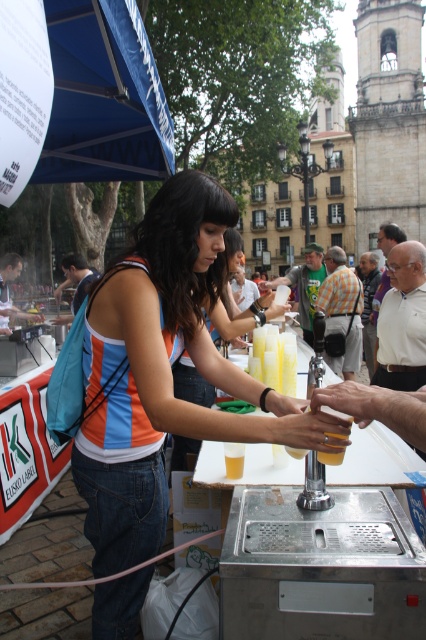
Question: Does white cotton shirt at center have a greater width compared to orange striped shirt at center?

Choices:
 (A) no
 (B) yes

Answer: (B)

Question: Which object is closer to the camera taking this photo?

Choices:
 (A) matte orange tank top at center
 (B) matte black shirt at lower left
 (C) blue denim jeans at lower left
 (D) green fabric shirt at center

Answer: (A)

Question: Is orange striped shirt at center further to the viewer compared to matte black shirt at lower left?

Choices:
 (A) no
 (B) yes

Answer: (B)

Question: Which object is positioned farthest from the matte black shirt at lower left?

Choices:
 (A) matte orange tank top at center
 (B) white cotton shirt at center
 (C) checkered fabric shirt at center

Answer: (B)

Question: Which of the following is the farthest from the observer?

Choices:
 (A) blue denim jeans at lower left
 (B) matte orange tank top at center
 (C) white cotton shirt at center

Answer: (A)

Question: Does matte orange tank top at center have a greater width compared to matte black shirt at lower left?

Choices:
 (A) yes
 (B) no

Answer: (B)